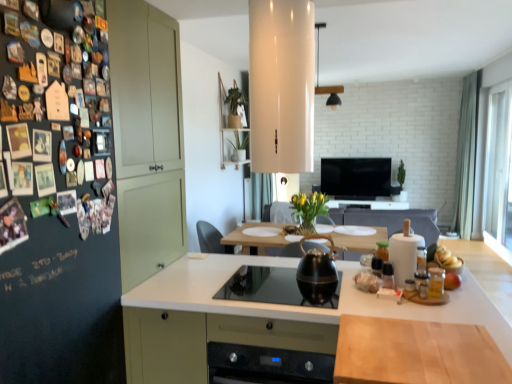
Question: Is yellow matte bananas at right, which ranks as the first food in back-to-front order, inside or outside of transparent glass window at right?

Choices:
 (A) inside
 (B) outside

Answer: (B)

Question: From a real-world perspective, is yellow matte bananas at right, which ranks as the first food in back-to-front order, above or below transparent glass window at right?

Choices:
 (A) below
 (B) above

Answer: (A)

Question: Which of these objects is positioned closest to the dark matte board at left?

Choices:
 (A) yellow matte vase at center
 (B) white glossy countertop at center, which appears as the 1th countertop when viewed from the back
 (C) translucent glass jar at right, the 2th food positioned from the top
 (D) yellow matte bananas at right, which ranks as the first food in back-to-front order
 (E) black glass gas stove at center

Answer: (B)

Question: Considering the real-world distances, which object is closest to the black glossy tv at center?

Choices:
 (A) dark matte board at left
 (B) white glossy countertop at center, the 2th countertop from the top
 (C) shiny black kettle at center
 (D) yellow matte vase at center
 (E) yellow matte bananas at right, which ranks as the first food in back-to-front order

Answer: (D)